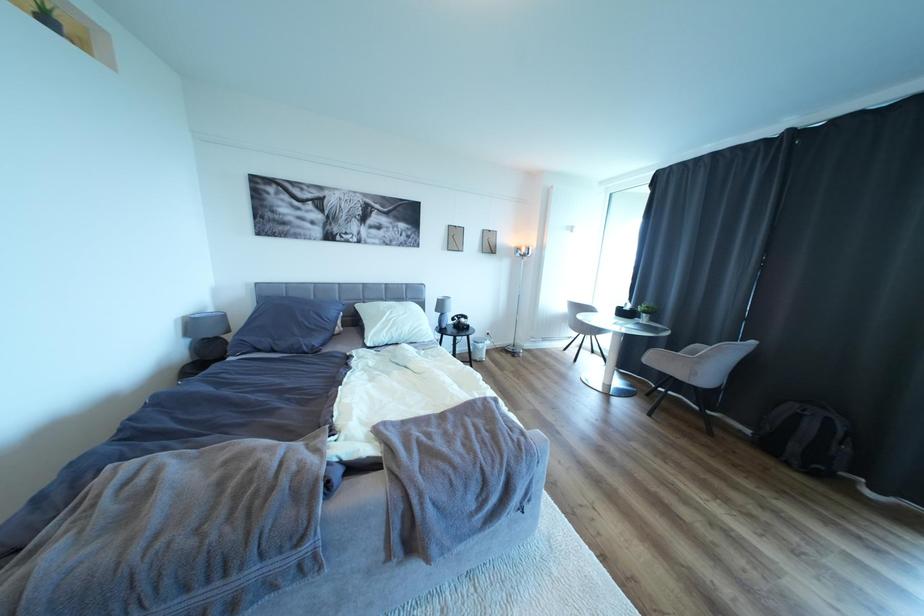
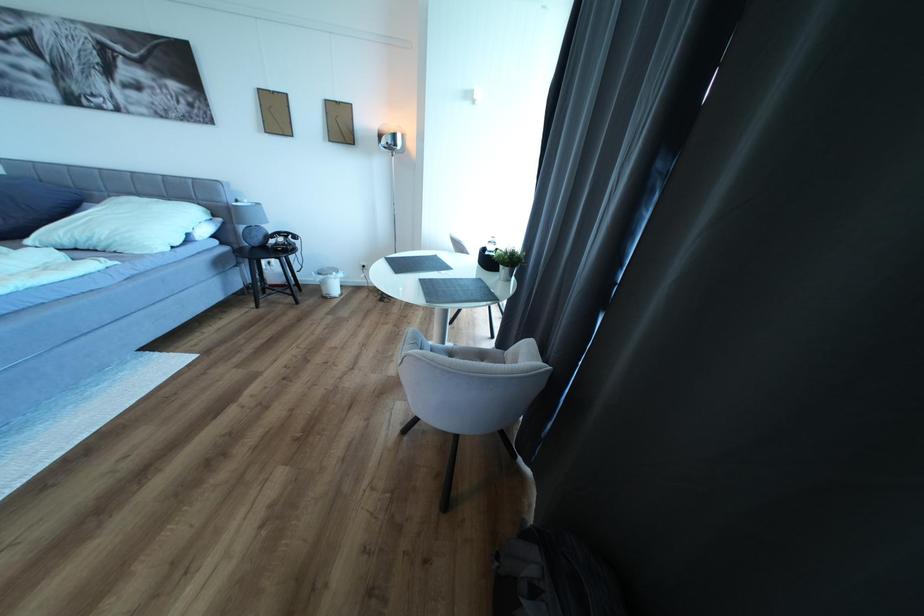
In a continuous first-person perspective shot, in which direction is the camera moving?

The cameraman moved toward right, forward.